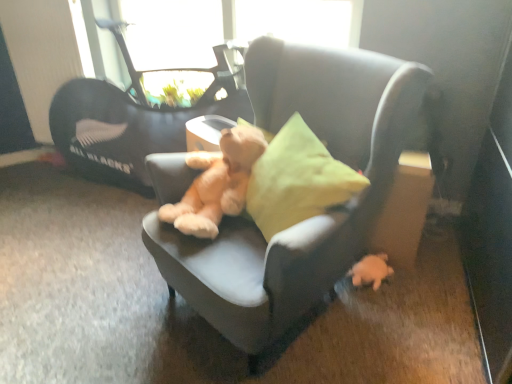
This screenshot has height=384, width=512. Describe the element at coordinates (230, 26) in the screenshot. I see `transparent glass window screen at upper center` at that location.

In order to face white plush toy at lower right, should I rotate leftwards or rightwards?

Turn right approximately 15.364 degrees to face it.

This screenshot has height=384, width=512. Identify the location of transparent glass window screen at upper center. (230, 26).

Is point (378, 262) positioned before point (136, 30)?

Yes.

Consider the image. Considering the positions of objects white plush toy at lower right and black fabric baby carriage at upper left in the image provided, who is behind, white plush toy at lower right or black fabric baby carriage at upper left?

Positioned behind is black fabric baby carriage at upper left.

Based on the photo, considering the sizes of white plush toy at lower right and black fabric baby carriage at upper left in the image, is white plush toy at lower right bigger or smaller than black fabric baby carriage at upper left?

white plush toy at lower right is smaller than black fabric baby carriage at upper left.

How far apart are white plush toy at lower right and black fabric baby carriage at upper left?

white plush toy at lower right and black fabric baby carriage at upper left are 4.27 feet apart.

Is point (331, 33) more distant than point (178, 222)?

Yes, point (331, 33) is farther from viewer.

From the picture: Can soft beige teddy bear at center be found inside transparent glass window screen at upper center?

That's incorrect, soft beige teddy bear at center is not inside transparent glass window screen at upper center.

Does transparent glass window screen at upper center have a lesser width compared to soft beige teddy bear at center?

Correct, the width of transparent glass window screen at upper center is less than that of soft beige teddy bear at center.

Consider the image. Can you confirm if transparent glass window screen at upper center is smaller than soft beige teddy bear at center?

No.

Considering the sizes of black fabric baby carriage at upper left and soft gray chair at center in the image, is black fabric baby carriage at upper left taller or shorter than soft gray chair at center?

In the image, black fabric baby carriage at upper left appears to be shorter than soft gray chair at center.

Which object is further away from the camera taking this photo, black fabric baby carriage at upper left or soft gray chair at center?

black fabric baby carriage at upper left is more distant.

Which object is positioned more to the right, black fabric baby carriage at upper left or soft gray chair at center?

soft gray chair at center is more to the right.

You are a GUI agent. You are given a task and a screenshot of the screen. Output one action in this format:
    pyautogui.click(x=<x>, y=<y>)
    Task: Click on the chair lying on the right of black fabric baby carriage at upper left
    
    Given the screenshot: What is the action you would take?
    pyautogui.click(x=312, y=218)

Consider the image. From the image's perspective, is transparent glass window screen at upper center above black fabric baby carriage at upper left?

Yes.

In terms of width, does transparent glass window screen at upper center look wider or thinner when compared to black fabric baby carriage at upper left?

Clearly, transparent glass window screen at upper center has less width compared to black fabric baby carriage at upper left.

The height and width of the screenshot is (384, 512). I want to click on baby carriage in front of the transparent glass window screen at upper center, so click(145, 103).

In terms of height, does transparent glass window screen at upper center look taller or shorter compared to soft gray chair at center?

transparent glass window screen at upper center is shorter than soft gray chair at center.

Which of these two, transparent glass window screen at upper center or soft gray chair at center, is wider?

soft gray chair at center is wider.

Does transparent glass window screen at upper center appear on the left side of soft gray chair at center?

Yes, transparent glass window screen at upper center is to the left of soft gray chair at center.

Are transparent glass window screen at upper center and soft gray chair at center far apart?

Yes.

Is black fabric baby carriage at upper left bigger or smaller than soft beige teddy bear at center?

black fabric baby carriage at upper left is bigger than soft beige teddy bear at center.

Is black fabric baby carriage at upper left not near soft beige teddy bear at center?

Actually, black fabric baby carriage at upper left and soft beige teddy bear at center are a little close together.

How distant is black fabric baby carriage at upper left from soft beige teddy bear at center?

23.73 inches.

Is black fabric baby carriage at upper left facing away from soft beige teddy bear at center?

No, black fabric baby carriage at upper left is not facing the opposite direction of soft beige teddy bear at center.

Locate an element on the screen. The height and width of the screenshot is (384, 512). chair below the soft beige teddy bear at center (from a real-world perspective) is located at coordinates (312, 218).

From the image's perspective, between soft gray chair at center and soft beige teddy bear at center, who is located below?

soft gray chair at center.

Which of these two, soft gray chair at center or soft beige teddy bear at center, is smaller?

With smaller size is soft beige teddy bear at center.

Could you tell me if soft gray chair at center is turned towards soft beige teddy bear at center?

Yes, soft gray chair at center is aimed at soft beige teddy bear at center.

Image resolution: width=512 pixels, height=384 pixels. Identify the location of toy that is in front of the black fabric baby carriage at upper left. (371, 270).

Where is `teddy bear lying on the left of transparent glass window screen at upper center`? This screenshot has height=384, width=512. teddy bear lying on the left of transparent glass window screen at upper center is located at coordinates (217, 183).

Looking at this image, considering their positions, is soft gray chair at center positioned further to soft beige teddy bear at center than black fabric baby carriage at upper left?

Based on the image, black fabric baby carriage at upper left appears to be further to soft beige teddy bear at center.

Based on their spatial positions, is soft gray chair at center or transparent glass window screen at upper center further from black fabric baby carriage at upper left?

transparent glass window screen at upper center is positioned further to the anchor black fabric baby carriage at upper left.

Based on their spatial positions, is black fabric baby carriage at upper left or soft gray chair at center further from soft beige teddy bear at center?

The object further to soft beige teddy bear at center is black fabric baby carriage at upper left.

Based on their spatial positions, is white plush toy at lower right or soft gray chair at center further from black fabric baby carriage at upper left?

white plush toy at lower right.

When comparing their distances from soft gray chair at center, does white plush toy at lower right or black fabric baby carriage at upper left seem further?

Among the two, black fabric baby carriage at upper left is located further to soft gray chair at center.

When comparing their distances from black fabric baby carriage at upper left, does white plush toy at lower right or soft beige teddy bear at center seem further?

white plush toy at lower right lies further to black fabric baby carriage at upper left than the other object.

Which object lies further to the anchor point soft gray chair at center, white plush toy at lower right or soft beige teddy bear at center?

white plush toy at lower right.

When comparing their distances from white plush toy at lower right, does soft gray chair at center or transparent glass window screen at upper center seem further?

transparent glass window screen at upper center lies further to white plush toy at lower right than the other object.

I want to click on teddy bear between soft gray chair at center and black fabric baby carriage at upper left in the front-back direction, so click(217, 183).

At what (x,y) coordinates should I click in order to perform the action: click on baby carriage between soft gray chair at center and transparent glass window screen at upper center from front to back. Please return your answer as a coordinate pair (x, y). The width and height of the screenshot is (512, 384). Looking at the image, I should click on (145, 103).

This screenshot has width=512, height=384. I want to click on baby carriage between transparent glass window screen at upper center and white plush toy at lower right in the up-down direction, so click(x=145, y=103).

Image resolution: width=512 pixels, height=384 pixels. I want to click on toy between soft gray chair at center and transparent glass window screen at upper center from front to back, so click(371, 270).